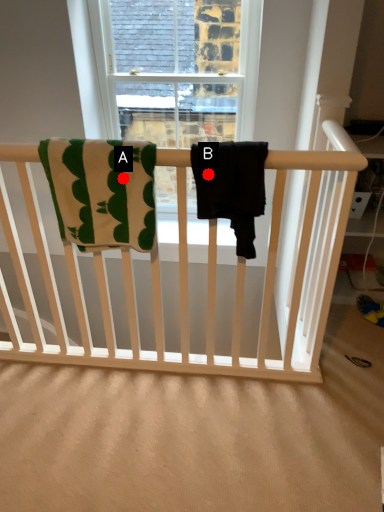
Question: Two points are circled on the image, labeled by A and B beside each circle. Which of the following is the farthest from the observer?

Choices:
 (A) A is further
 (B) B is further

Answer: (A)